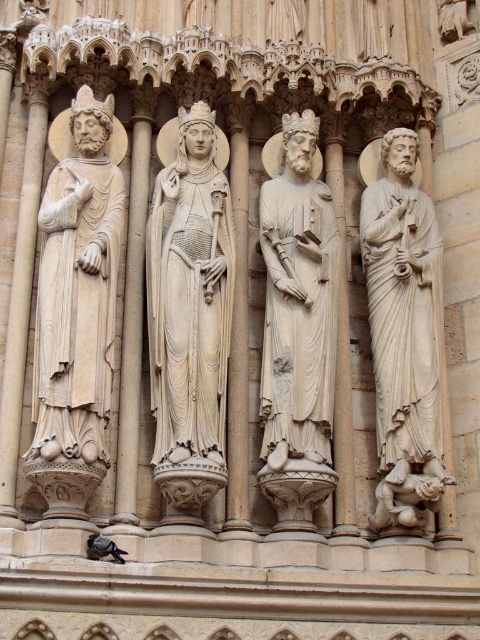
You are an architect examining the Gothic facade. You notice the white marble statue at center and the white stone pillar at left. Based on their positions, which one is positioned lower in the image?

The white marble statue at center is below the white stone pillar at left, so it is positioned lower in the image.

You are an architect examining the Gothic facade. You notice the beige stone statue at left and the white marble statue at right. Which statue is placed higher up on the facade?

The beige stone statue at left is positioned over the white marble statue at right, meaning it is placed higher up on the facade.

You are an architect examining the Gothic facade. You need to determine which statue is taller between the white stone statue at center and the white marble statue at right. Based on the description, which one is taller?

The white stone statue at center is taller than the white marble statue at right according to the description.